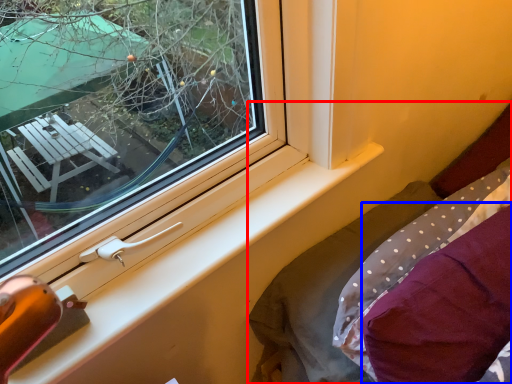
Question: Among these objects, which one is farthest to the camera, bed (highlighted by a red box) or pillow (highlighted by a blue box)?

Choices:
 (A) bed
 (B) pillow

Answer: (A)